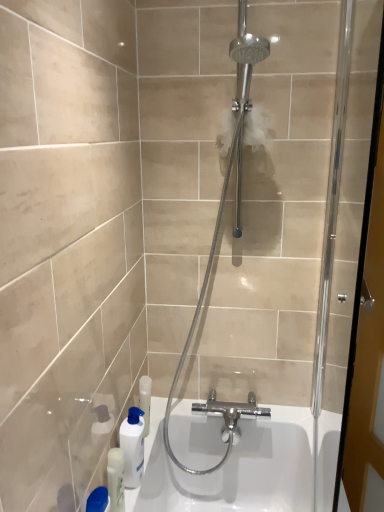
Question: Is white glossy bottle at lower left taller or shorter than white glossy bottle at lower left?

Choices:
 (A) short
 (B) tall

Answer: (A)

Question: From a real-world perspective, is white glossy bottle at lower left above or below white glossy bottle at lower left?

Choices:
 (A) below
 (B) above

Answer: (A)

Question: Estimate the real-world distances between objects in this image. Which object is closer to the white glossy bottle at lower left?

Choices:
 (A) white glossy bottle at lower left
 (B) polished chrome shower head at center

Answer: (A)

Question: Based on their relative distances, which object is farther from the white glossy bottle at lower left?

Choices:
 (A) polished chrome shower head at center
 (B) white glossy bottle at lower left

Answer: (A)